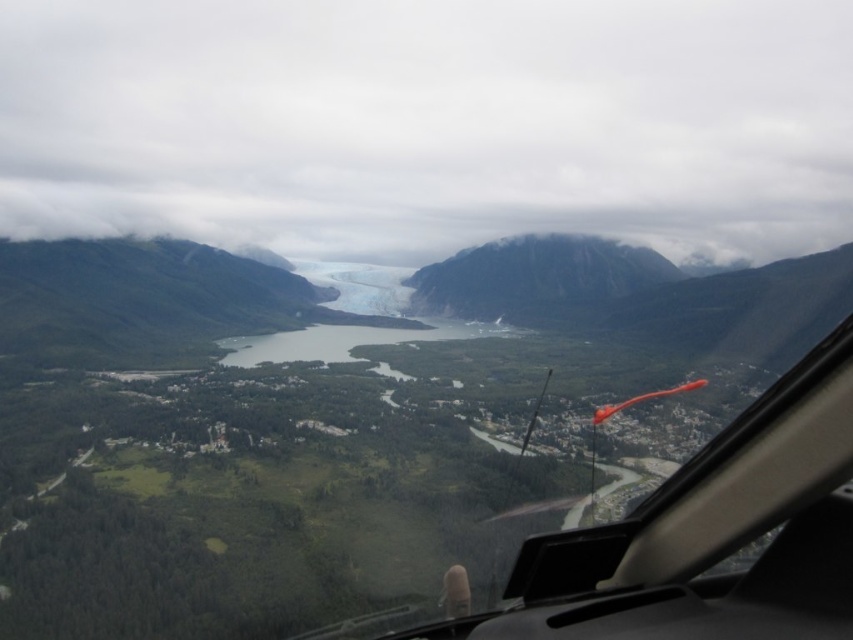
Question: Does rugged granite mountain at center have a smaller size compared to gray/rocky lake at center?

Choices:
 (A) no
 (B) yes

Answer: (A)

Question: Which point is closer to the camera?

Choices:
 (A) rugged granite mountain at center
 (B) gray/rocky lake at center

Answer: (B)

Question: Which object is farther from the camera taking this photo?

Choices:
 (A) gray/rocky lake at center
 (B) rugged granite mountain at center

Answer: (B)

Question: Considering the relative positions of rugged granite mountain at center and gray/rocky lake at center in the image provided, where is rugged granite mountain at center located with respect to gray/rocky lake at center?

Choices:
 (A) above
 (B) below

Answer: (A)

Question: Is rugged granite mountain at center closer to camera compared to gray/rocky lake at center?

Choices:
 (A) yes
 (B) no

Answer: (B)